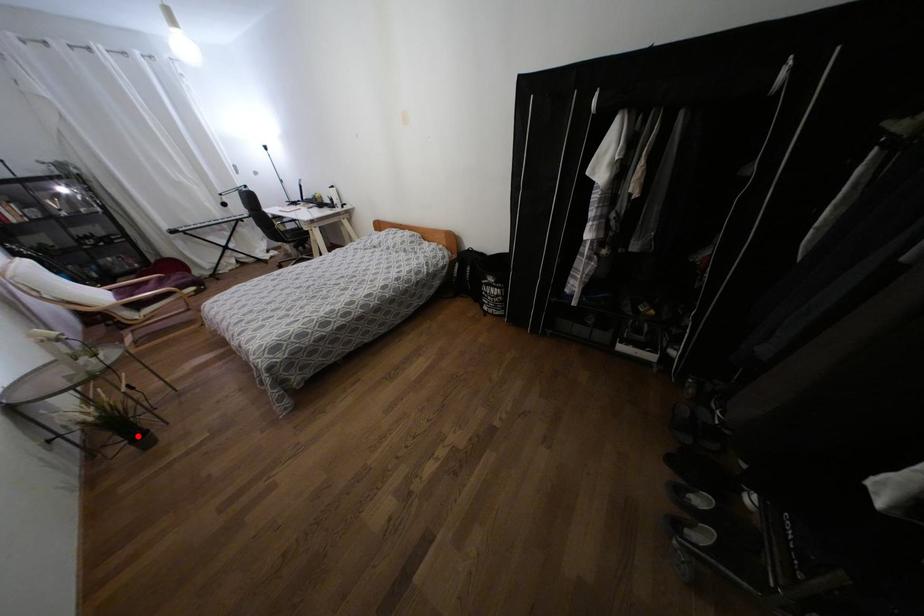
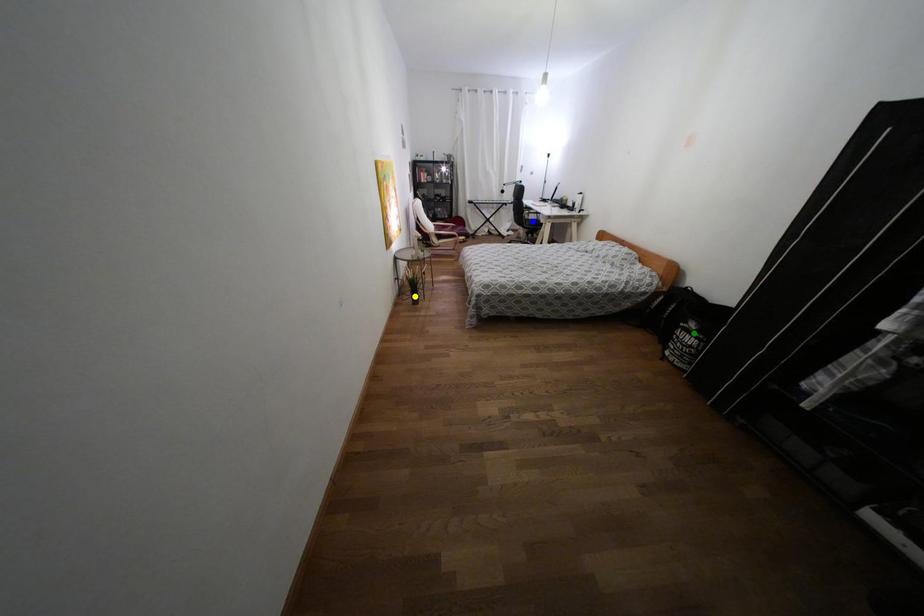
Question: I am providing you with two images of the same scene from different viewpoints. A red point is marked on the first image. You are given multiple points on the second image. Which mark in image 2 goes with the point in image 1?

Choices:
 (A) green point
 (B) blue point
 (C) yellow point

Answer: (C)